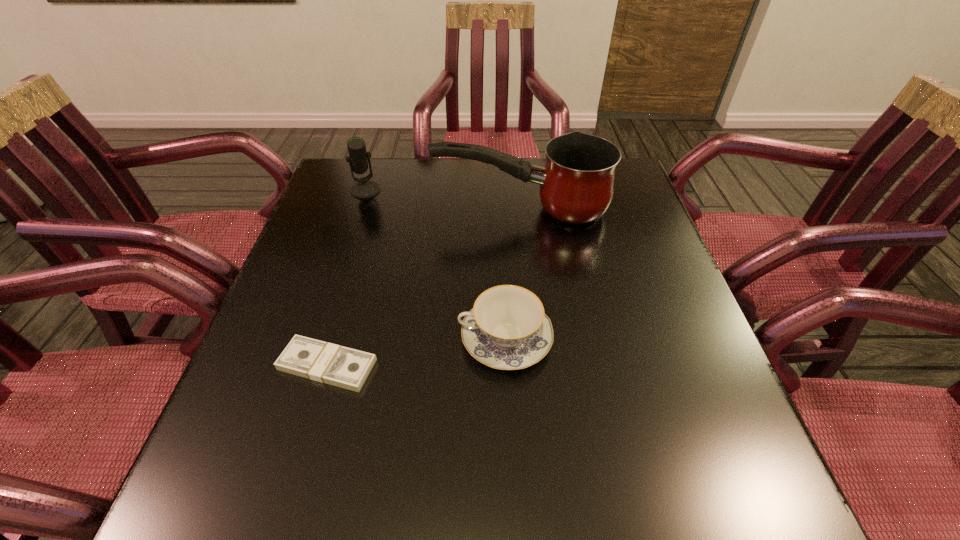
This screenshot has height=540, width=960. Find the location of `vacant space at the left edge of the desktop`. vacant space at the left edge of the desktop is located at coordinates (339, 234).

Locate an element on the screen. The image size is (960, 540). vacant space at the right edge is located at coordinates (624, 289).

Identify the location of vacant space at the far left corner. The width and height of the screenshot is (960, 540). (386, 175).

What are the coordinates of `free space at the far right corner of the desktop` in the screenshot? It's located at (632, 176).

You are a GUI agent. You are given a task and a screenshot of the screen. Output one action in this format:
    pyautogui.click(x=<x>, y=<y>)
    Task: Click on the empty location between the tallest object and the second tallest object
    
    Given the screenshot: What is the action you would take?
    [x=443, y=199]

The height and width of the screenshot is (540, 960). I want to click on empty location between the dollar and the saucepan, so click(424, 287).

The width and height of the screenshot is (960, 540). What are the coordinates of `vacant space in between the second shortest object and the saucepan` in the screenshot? It's located at (513, 274).

The height and width of the screenshot is (540, 960). I want to click on empty location between the tallest object and the chinaware, so click(513, 274).

This screenshot has width=960, height=540. Identify the location of vacant region between the saucepan and the dollar. (424, 287).

Image resolution: width=960 pixels, height=540 pixels. I want to click on vacant space that is in between the tallest object and the second tallest object, so click(443, 199).